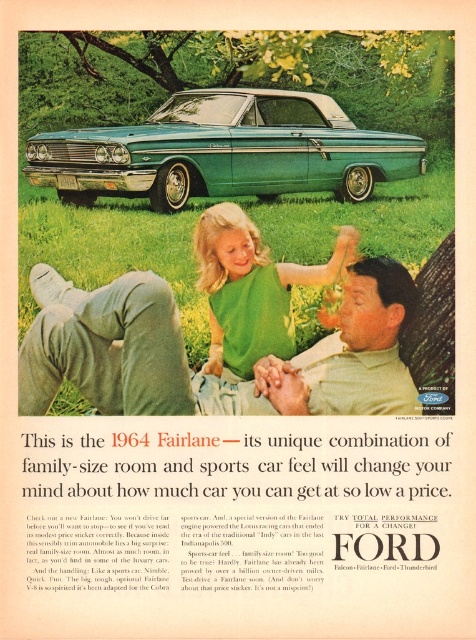
Question: Which point is closer to the camera?

Choices:
 (A) pos(284,115)
 (B) pos(370,269)
 (C) pos(244,365)

Answer: (B)

Question: Which point is closer to the camera?

Choices:
 (A) (218, 268)
 (B) (108, 134)
 (C) (73, 339)

Answer: (C)

Question: Among these objects, which one is nearest to the camera?

Choices:
 (A) green fabric shirt at center
 (B) green metallic car at center

Answer: (A)

Question: From the image, what is the correct spatial relationship of green fabric pants at lower left in relation to green fabric shirt at center?

Choices:
 (A) above
 (B) below

Answer: (B)

Question: Is green fabric pants at lower left smaller than green metallic car at center?

Choices:
 (A) yes
 (B) no

Answer: (A)

Question: Can you confirm if green fabric pants at lower left is positioned to the right of green fabric shirt at center?

Choices:
 (A) yes
 (B) no

Answer: (B)